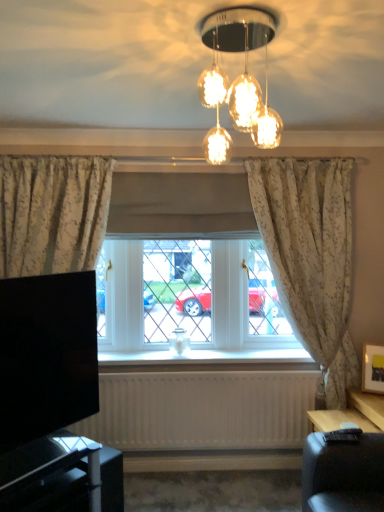
Question: From the image's perspective, is floral fabric curtain at right located beneath translucent glass light fixture at upper center?

Choices:
 (A) yes
 (B) no

Answer: (A)

Question: Considering the relative sizes of floral fabric curtain at right and translucent glass light fixture at upper center in the image provided, is floral fabric curtain at right shorter than translucent glass light fixture at upper center?

Choices:
 (A) yes
 (B) no

Answer: (B)

Question: Can you confirm if floral fabric curtain at right is thinner than translucent glass light fixture at upper center?

Choices:
 (A) no
 (B) yes

Answer: (B)

Question: Is floral fabric curtain at right facing towards translucent glass light fixture at upper center?

Choices:
 (A) yes
 (B) no

Answer: (A)

Question: Can you confirm if floral fabric curtain at right is positioned to the left of translucent glass light fixture at upper center?

Choices:
 (A) no
 (B) yes

Answer: (A)

Question: Relative to white textured radiator at lower center, is black glossy tv stand at lower left in front or behind?

Choices:
 (A) front
 (B) behind

Answer: (A)

Question: Do you think black glossy tv stand at lower left is within white textured radiator at lower center, or outside of it?

Choices:
 (A) outside
 (B) inside

Answer: (A)

Question: Considering the positions of black glossy tv stand at lower left and white textured radiator at lower center in the image, is black glossy tv stand at lower left taller or shorter than white textured radiator at lower center?

Choices:
 (A) short
 (B) tall

Answer: (A)

Question: From the image's perspective, relative to white textured radiator at lower center, is black glossy tv stand at lower left above or below?

Choices:
 (A) above
 (B) below

Answer: (B)

Question: Is point (99, 355) closer or farther from the camera than point (11, 322)?

Choices:
 (A) farther
 (B) closer

Answer: (A)

Question: Is white wood window sill at center taller or shorter than black glossy tv at lower left?

Choices:
 (A) tall
 (B) short

Answer: (B)

Question: In terms of width, does white wood window sill at center look wider or thinner when compared to black glossy tv at lower left?

Choices:
 (A) wide
 (B) thin

Answer: (A)

Question: Is white wood window sill at center bigger or smaller than black glossy tv at lower left?

Choices:
 (A) small
 (B) big

Answer: (A)

Question: From a real-world perspective, is white wood window sill at center positioned above or below translucent glass light fixture at upper center?

Choices:
 (A) above
 (B) below

Answer: (B)

Question: Is white wood window sill at center wider or thinner than translucent glass light fixture at upper center?

Choices:
 (A) thin
 (B) wide

Answer: (A)